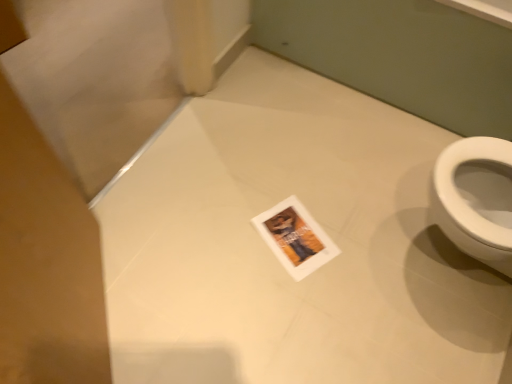
Identify the location of free space in front of white paper postcard at center. (287, 294).